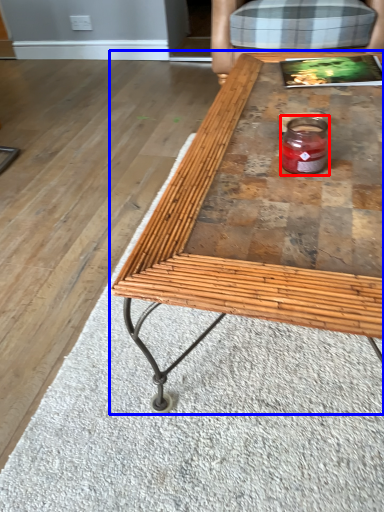
Question: Which object appears closest to the camera in this image, glass jar (highlighted by a red box) or coffee table (highlighted by a blue box)?

Choices:
 (A) glass jar
 (B) coffee table

Answer: (B)